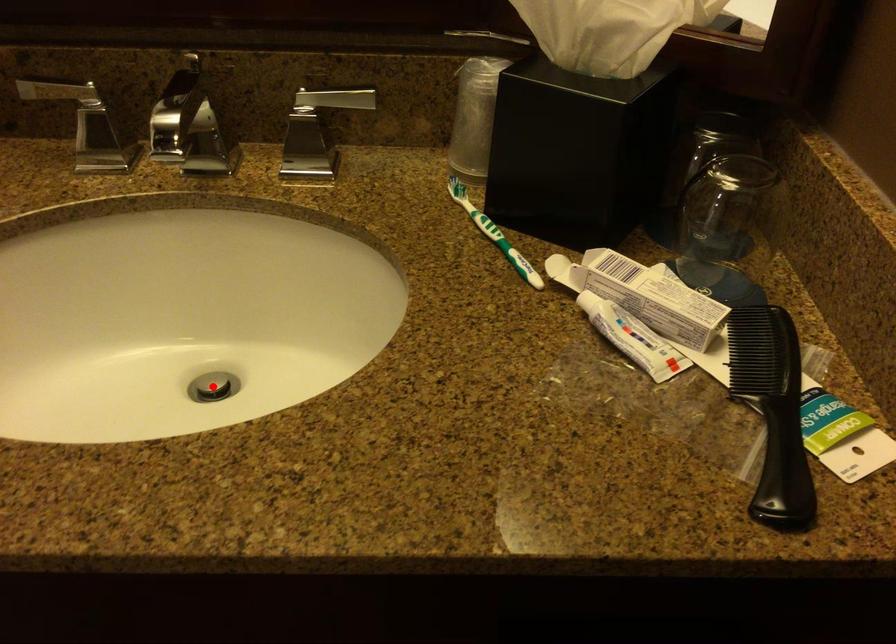
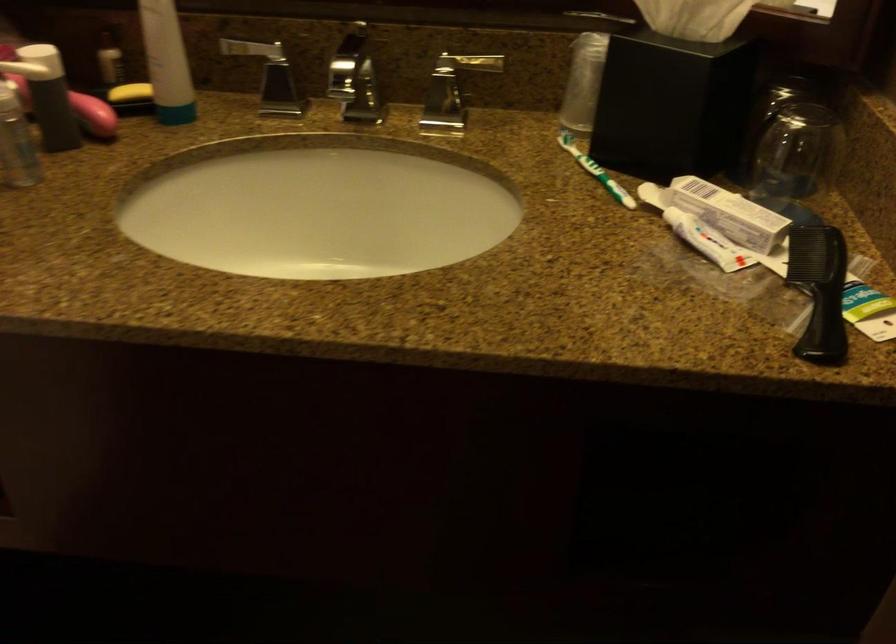
Question: I am providing you with two images of the same scene from different viewpoints. A red point is marked on the first image. Is the red point's position out of view in image 2?

Choices:
 (A) Yes
 (B) No

Answer: (A)